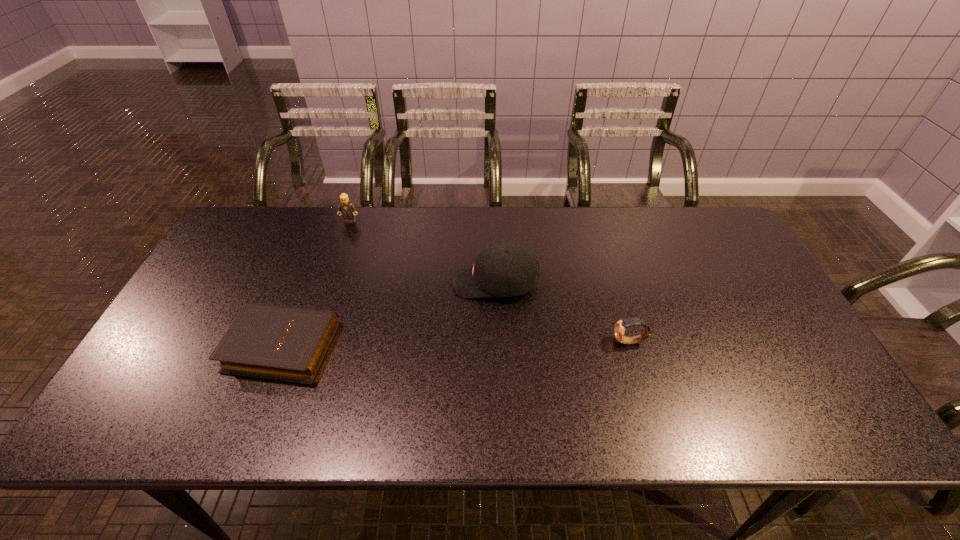
This screenshot has width=960, height=540. In order to click on the second farthest object in this screenshot , I will do `click(502, 270)`.

This screenshot has height=540, width=960. What are the coordinates of `baseball cap` in the screenshot? It's located at (502, 270).

Locate an element on the screen. The height and width of the screenshot is (540, 960). Lego is located at coordinates (346, 208).

This screenshot has width=960, height=540. In order to click on the farthest object in this screenshot , I will do `click(346, 208)`.

This screenshot has height=540, width=960. Find the location of `the third tallest object`. the third tallest object is located at coordinates (620, 326).

Find the location of `the rightmost object`. the rightmost object is located at coordinates (620, 326).

Identify the location of the shortest object. This screenshot has width=960, height=540. pyautogui.click(x=274, y=342).

This screenshot has width=960, height=540. Identify the location of vacant region located 0.050m with a logo on the front of the baseball cap. (436, 283).

Where is `vacant space located with a logo on the front of the baseball cap`? This screenshot has width=960, height=540. vacant space located with a logo on the front of the baseball cap is located at coordinates coord(353,283).

At what (x,y) coordinates should I click in order to perform the action: click on free space located with a logo on the front of the baseball cap. Please return your answer as a coordinate pair (x, y). The width and height of the screenshot is (960, 540). Looking at the image, I should click on (336, 283).